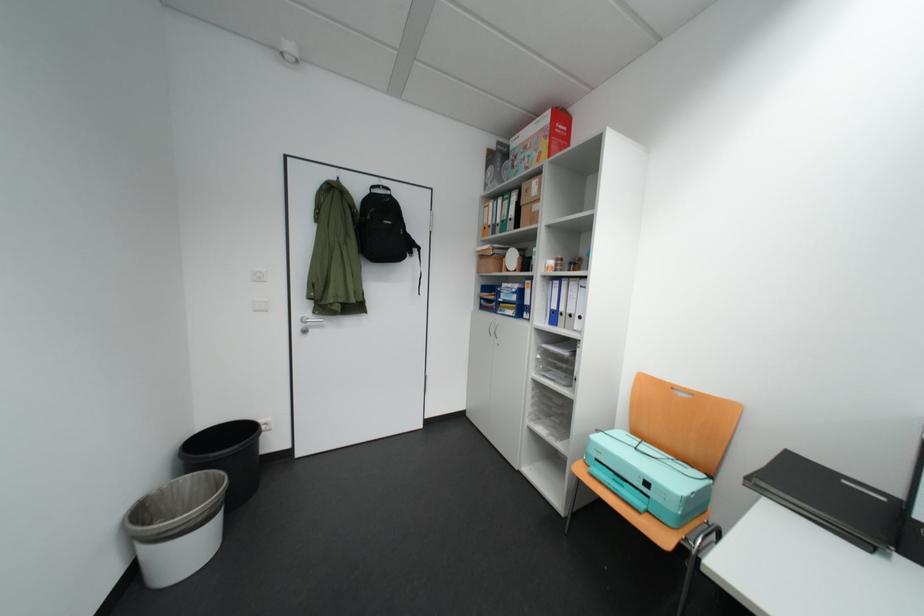
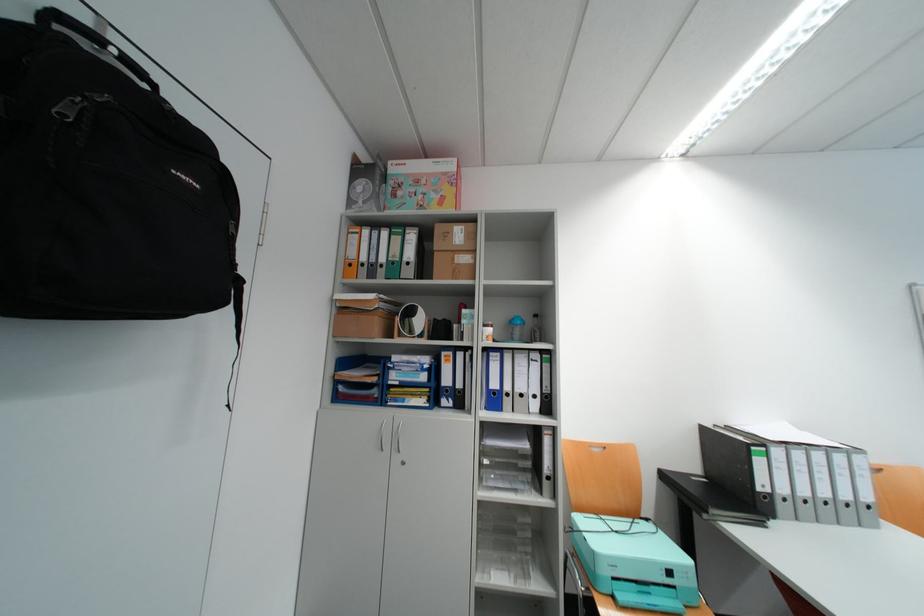
The point at (612, 451) is marked in the first image. Where is the corresponding point in the second image?

(624, 562)